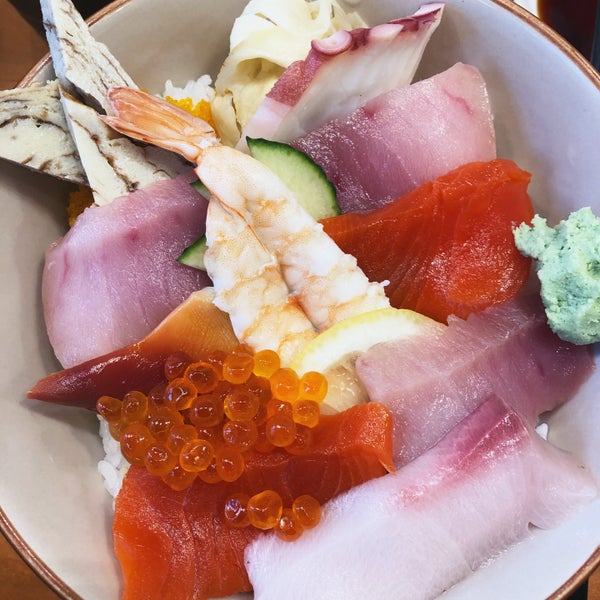
Identify the location of area below plate that looks like a wooden table. This screenshot has height=600, width=600. (32, 581).